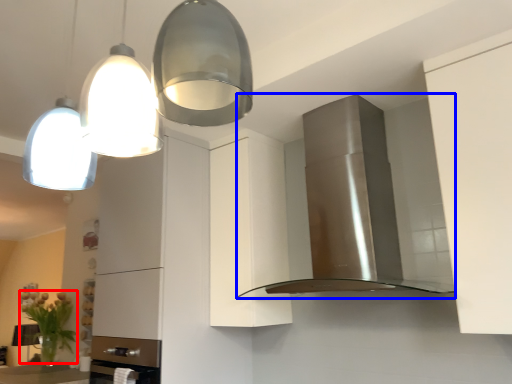
Question: Which object appears farthest to the camera in this image, plant (highlighted by a red box) or home appliance (highlighted by a blue box)?

Choices:
 (A) plant
 (B) home appliance

Answer: (A)